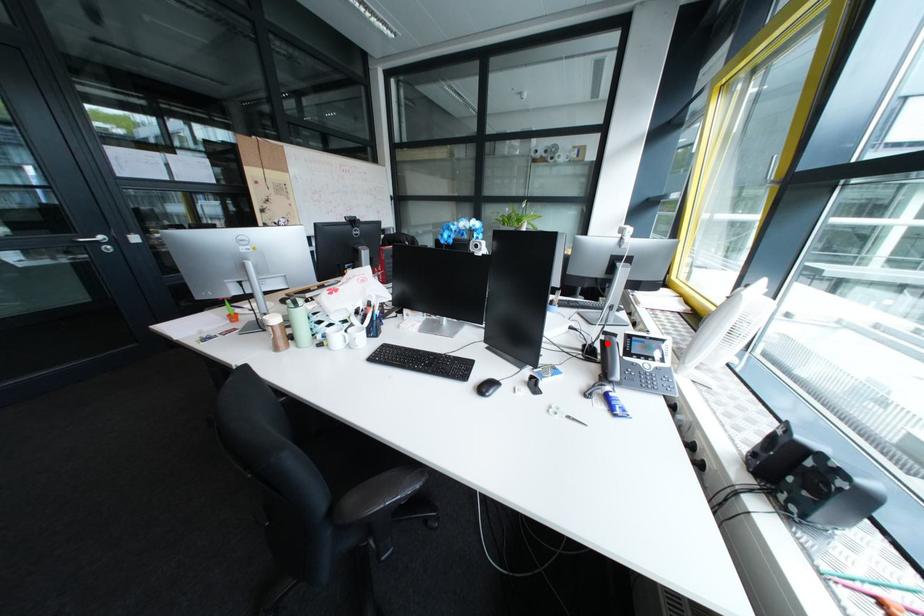
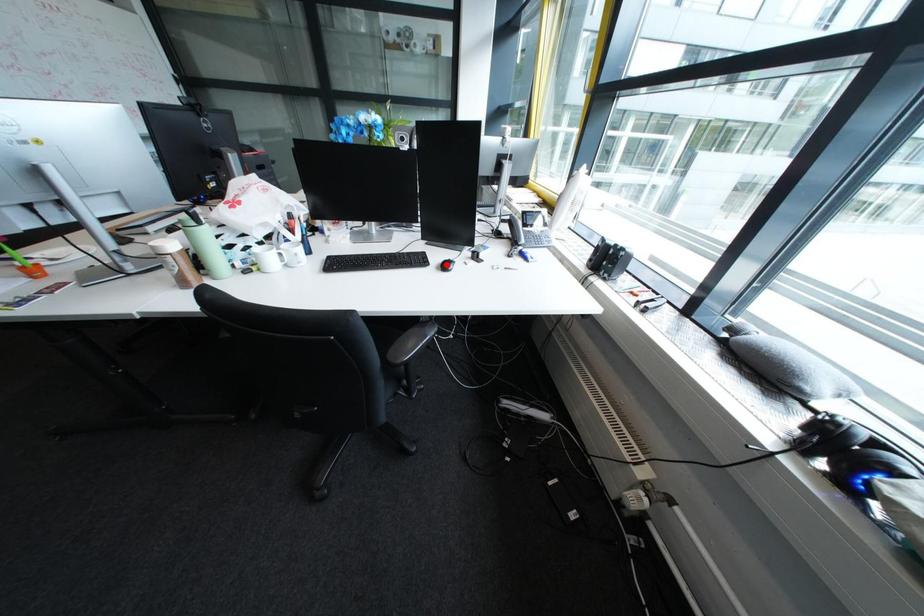
I am providing you with two images of the same scene from different viewpoints. A red point is marked on the first image and another point is marked on the second image. Are the points marked in image1 and image2 representing the same 3D position?

No